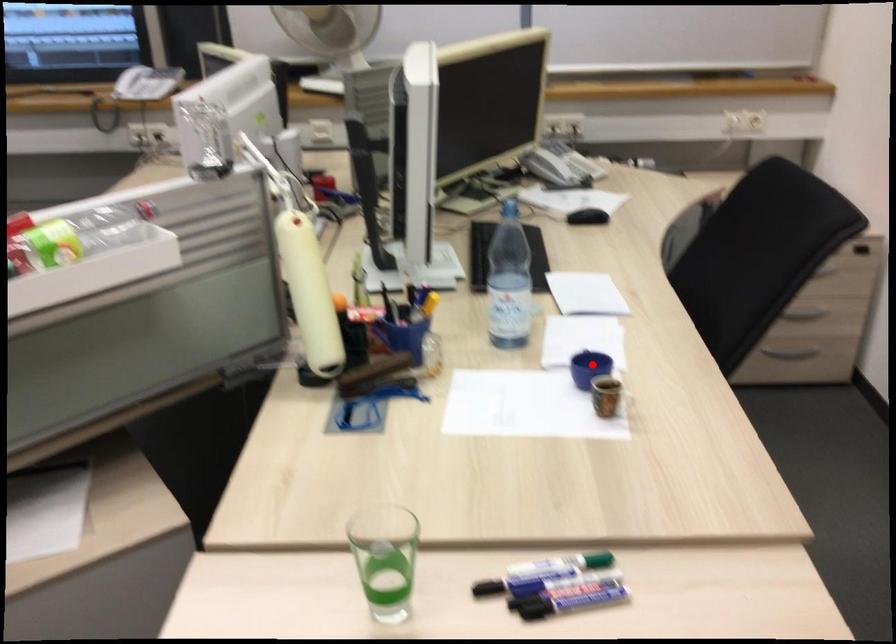
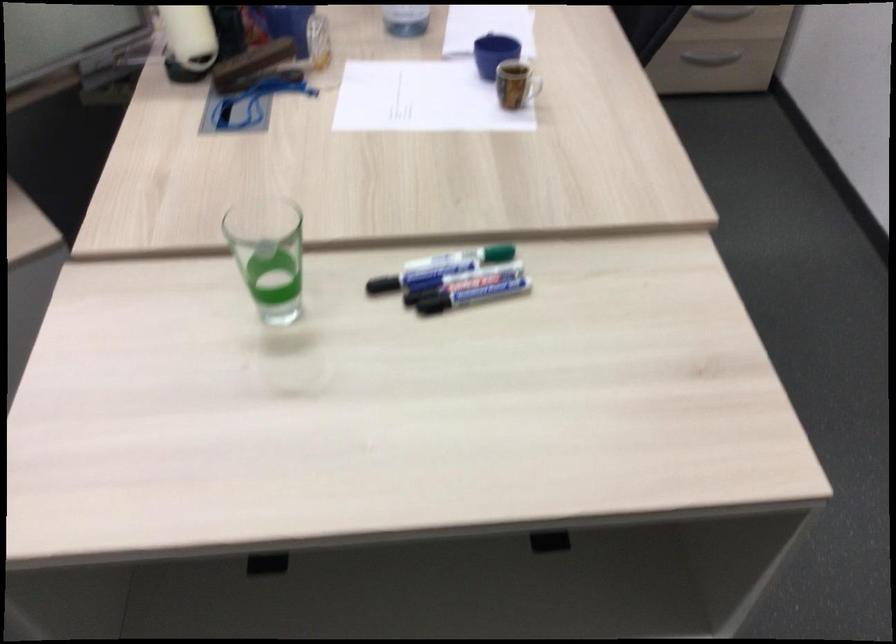
Where in the second image is the point corresponding to the highlighted location from the first image?

(494, 53)